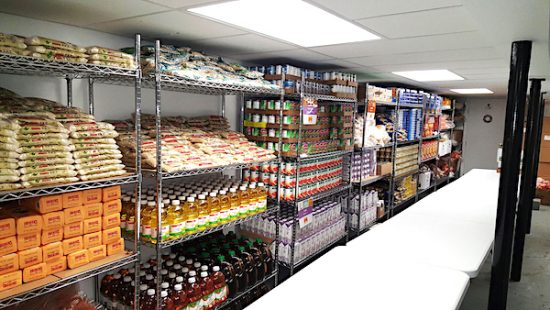
Where is `ceiling`? The image size is (550, 310). ceiling is located at coordinates (460, 51), (243, 41).